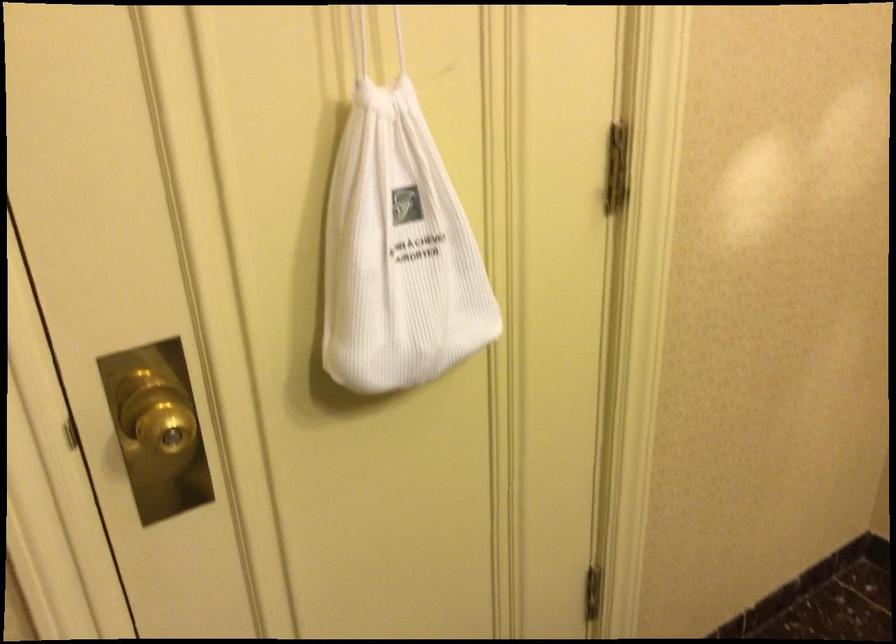
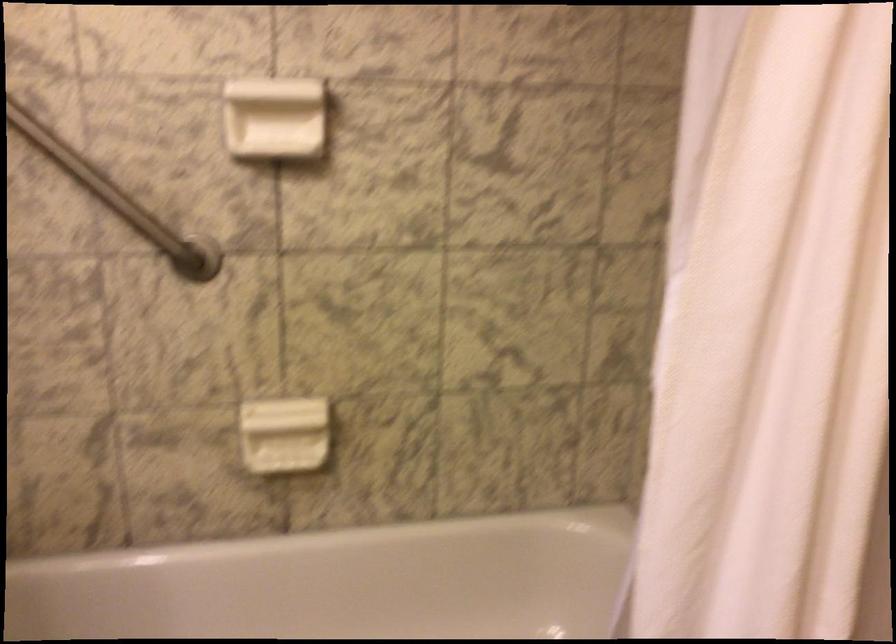
The first image is from the beginning of the video and the second image is from the end. How did the camera likely rotate when shooting the video?

The camera's rotation is toward left-down.